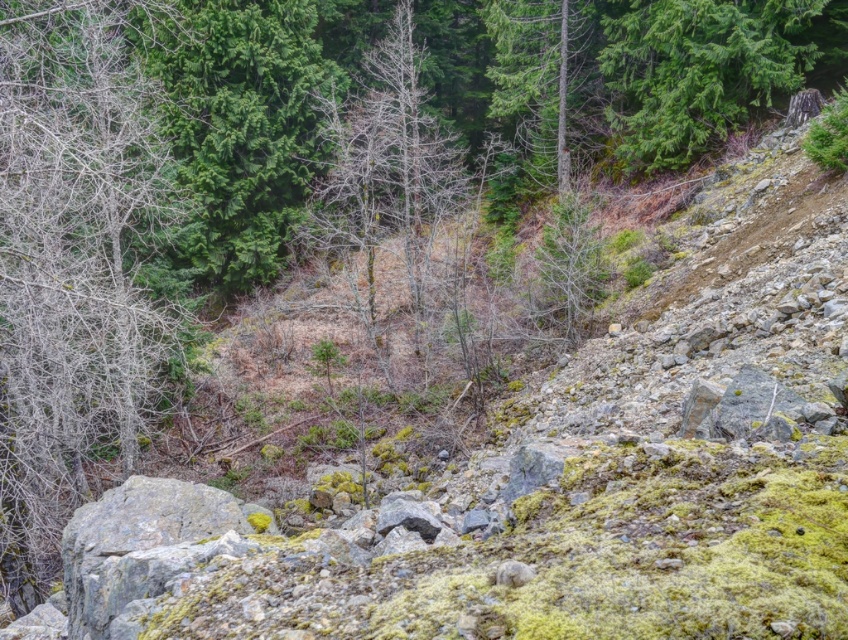
You are an environmental scientist assessing the health of this landscape. You observe the bare branches at left and the green textured tree at upper right. Which of these two has a wider spread of branches?

The bare branches at left have a wider spread than the green textured tree at upper right, as their width surpasses that of the latter.

You are an environmental scientist assessing the landscape. You observe the bare branches at left and the green textured tree at upper right. Which of these two trees has a greater height?

The bare branches at left is taller than the green textured tree at upper right according to the observation.